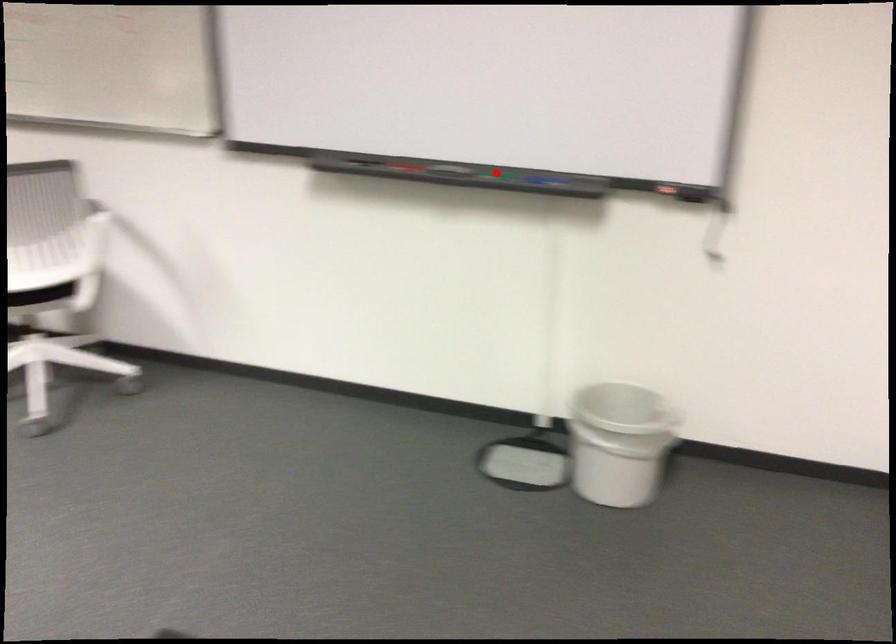
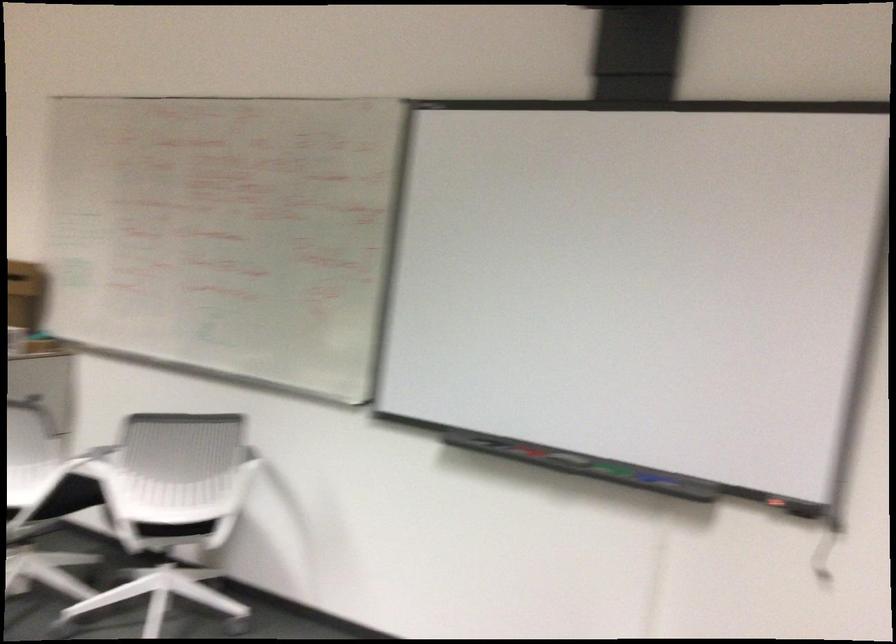
Locate, in the second image, the point that corresponds to the highlighted location in the first image.

(613, 469)